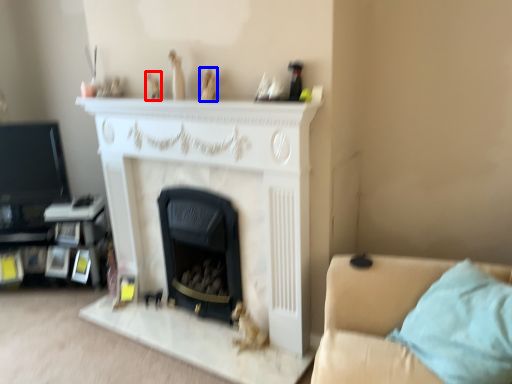
Question: Which object is further to the camera taking this photo, toy (highlighted by a red box) or toy (highlighted by a blue box)?

Choices:
 (A) toy
 (B) toy

Answer: (A)